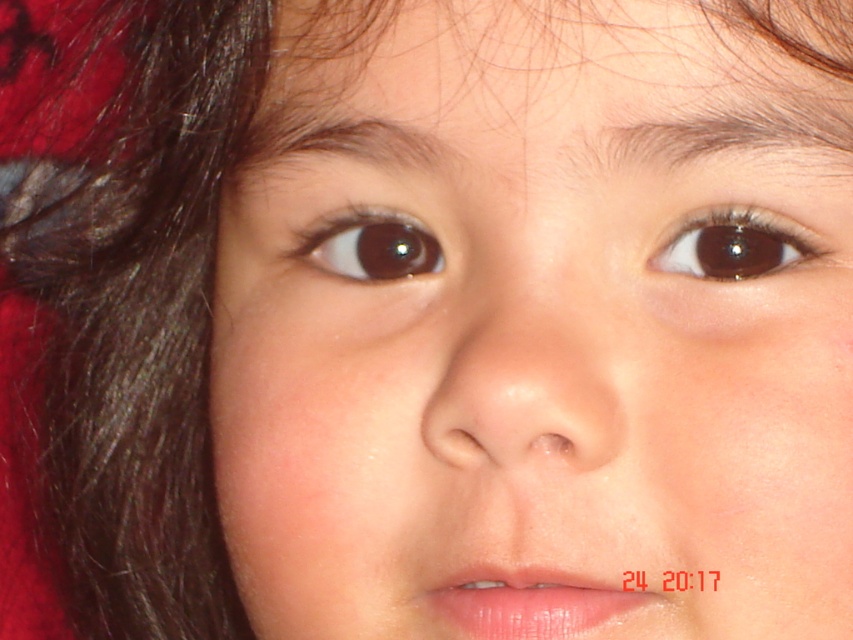
Question: From the image, what is the correct spatial relationship of dark brown hair at upper center in relation to brown shiny eye at upper center?

Choices:
 (A) below
 (B) above

Answer: (B)

Question: Which object is positioned closest to the dark brown hair at upper center?

Choices:
 (A) smooth skin at upper center
 (B) brown hair at upper center
 (C) brown shiny eye at upper center
 (D) pink matte lips at center

Answer: (A)

Question: Which point is closer to the camera?

Choices:
 (A) (369, 148)
 (B) (349, 253)
 (C) (698, 74)
 (D) (589, 454)

Answer: (D)

Question: Which of the following is the farthest from the observer?

Choices:
 (A) dark brown hair at upper center
 (B) smooth skin nose at center
 (C) brown hair at upper center
 (D) pink matte lips at center

Answer: (A)

Question: Can you confirm if brown hair at upper center is bigger than brown glossy eye at upper center?

Choices:
 (A) no
 (B) yes

Answer: (B)

Question: Does smooth skin nose at center appear over pink matte lips at center?

Choices:
 (A) yes
 (B) no

Answer: (A)